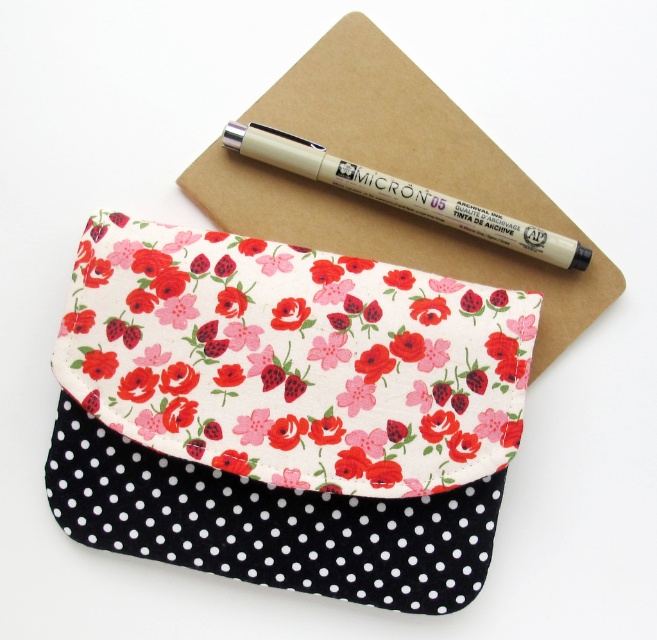
Looking at this image, you are organizing a desk and see the floral fabric notepad at upper center and the matte beige pen at upper center. Which object is positioned to the right side?

The floral fabric notepad at upper center is to the right of the matte beige pen at upper center.

Looking at the fabric pouch, which floral fabric flower is positioned more to the left? The floral fabric flower at center or the floral fabric flower at upper center?

The floral fabric flower at center is positioned more to the left than the floral fabric flower at upper center.